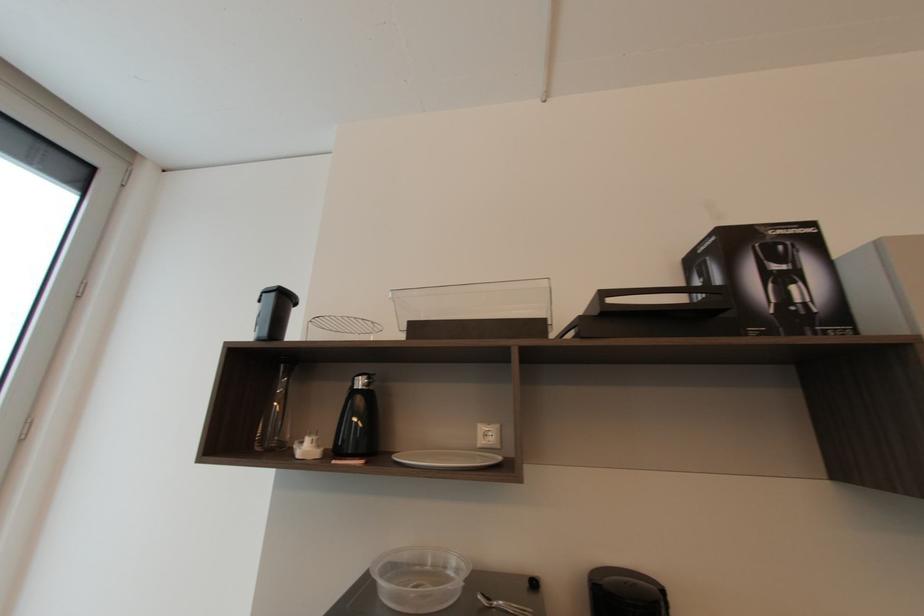
Locate an element on the screen. glass carafe is located at coordinates (358, 421).